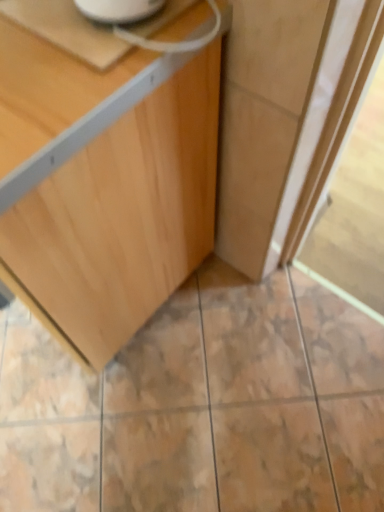
Question: Should I look upward or downward to see light wood cabinet at center?

Choices:
 (A) up
 (B) down

Answer: (A)